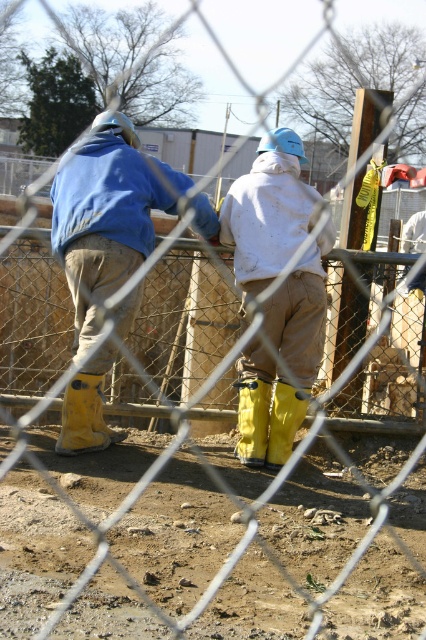
You are a construction inspector standing at the center of the fence. You need to locate the yellow rubber boot at lower left. Which direction should you look to find it?

The yellow rubber boot at lower left is located at point (85, 417), so you should look to your lower left direction to find it.

You are a safety inspector observing the construction site through the chain link fence. You notice two yellow rubber boots. Which one is closer to you, the yellow rubber boot at center or the yellow rubber boot at lower center?

The yellow rubber boot at center is closer to you because it is in front of the yellow rubber boot at lower center.